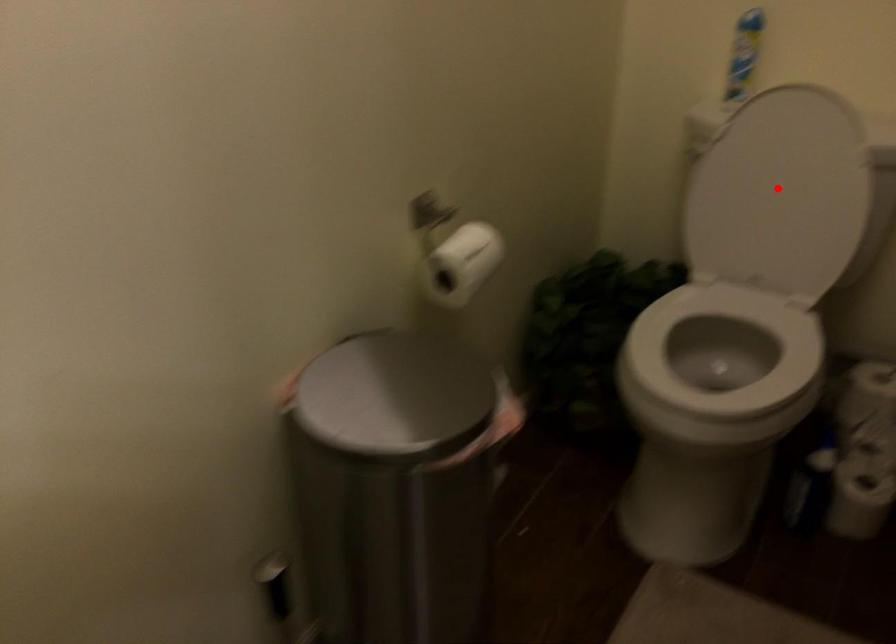
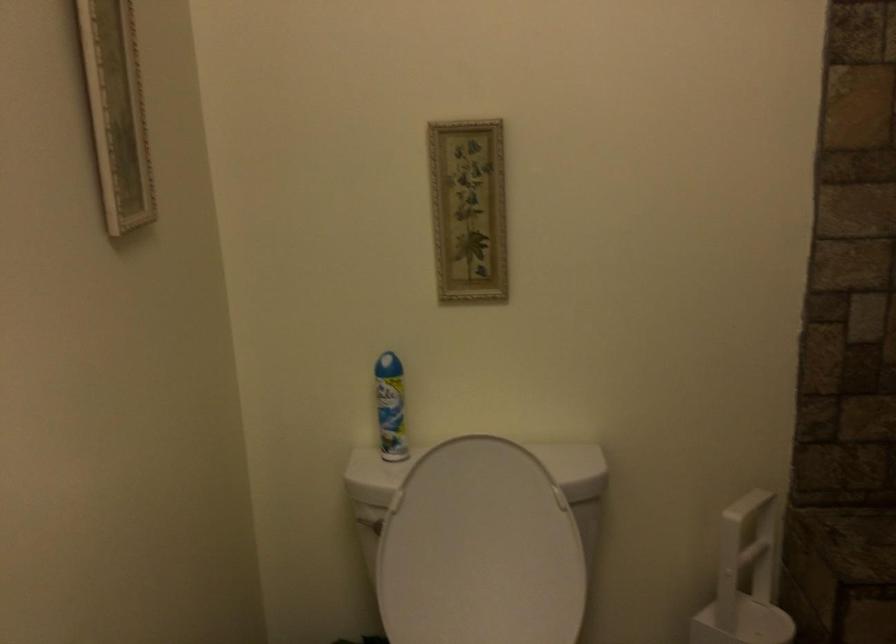
Question: A red point is marked in image1. In image2, is the corresponding 3D point closer to the camera or farther? Reply with the corresponding letter.

Choices:
 (A) The corresponding 3D point is closer.
 (B) The corresponding 3D point is farther.

Answer: (A)